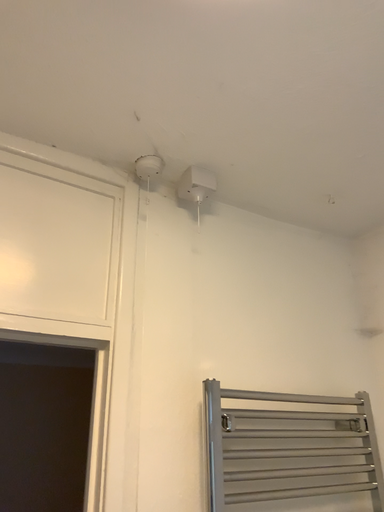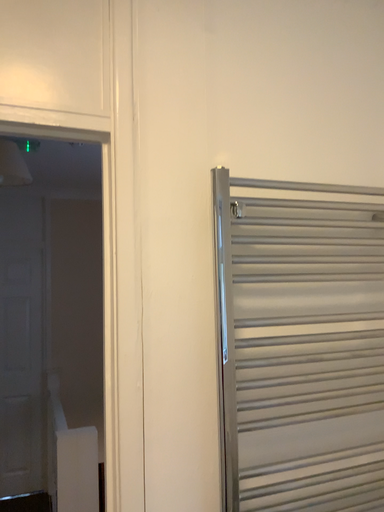
Question: Which way did the camera rotate in the video?

Choices:
 (A) rotated upward
 (B) rotated downward

Answer: (B)